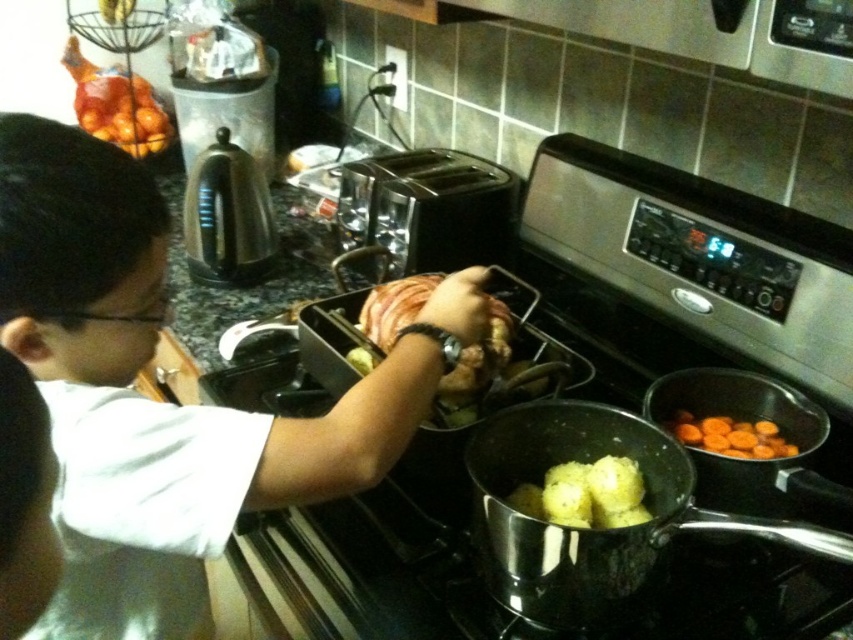
You are a delivery robot with a package that needs to be placed between the two points marked as point (97, 253). Can you fit the package there if the package is 24 inches long?

The distance between the two points marked as point (97, 253) is 23.26 inches. Since the package is 24 inches long, it will not fit between them as it is slightly longer than the available space.

You are standing in the kitchen and want to place a new spice jar between the two points labeled point (503, 586) and point (683, 428). Since the points are at different distances from you, which point should the spice jar be closer to in order to appear centered between them?

The spice jar should be placed closer to point (683, 428) because it is farther from the viewer than point (503, 586). To appear centered between them, the jar needs to compensate for their depth difference by positioning itself closer to the farther point.